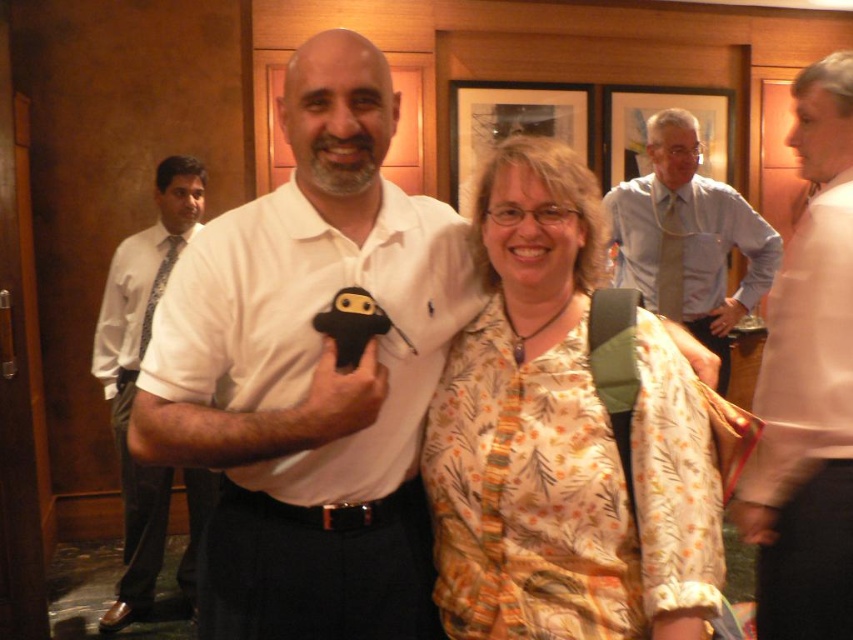
From the picture: You are standing at the origin point in the image. Which of the two points, point (225, 276) or point (489, 477), is closer to you?

Point (225, 276) is closer to you because it is in front of point (489, 477).

You are a photographer trying to adjust the focus on your camera to ensure both the white matte shirt at center and the floral print blouse at center are clearly visible. Given their sizes, which one might require more zoom to be seen in detail?

The white matte shirt at center is larger than the floral print blouse at center, so the floral print blouse at center might need more zoom to be seen in detail since it is smaller.

Based on the scene description, which object takes up more area in the image between the pink fabric shirt at right and the light blue shirt at upper right?

The light blue shirt at upper right occupies more space than the pink fabric shirt at right according to the description.